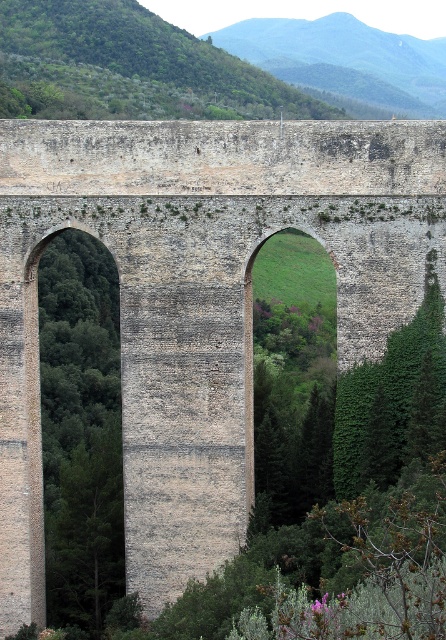
Is green leafy tree at upper left below green leafy hillside at upper center?

Correct, green leafy tree at upper left is located below green leafy hillside at upper center.

Is point (91, 99) less distant than point (248, 49)?

That is True.

Describe the element at coordinates (128, 67) in the screenshot. I see `green leafy tree at upper left` at that location.

Image resolution: width=446 pixels, height=640 pixels. What are the coordinates of `green leafy tree at upper left` in the screenshot? It's located at (128, 67).